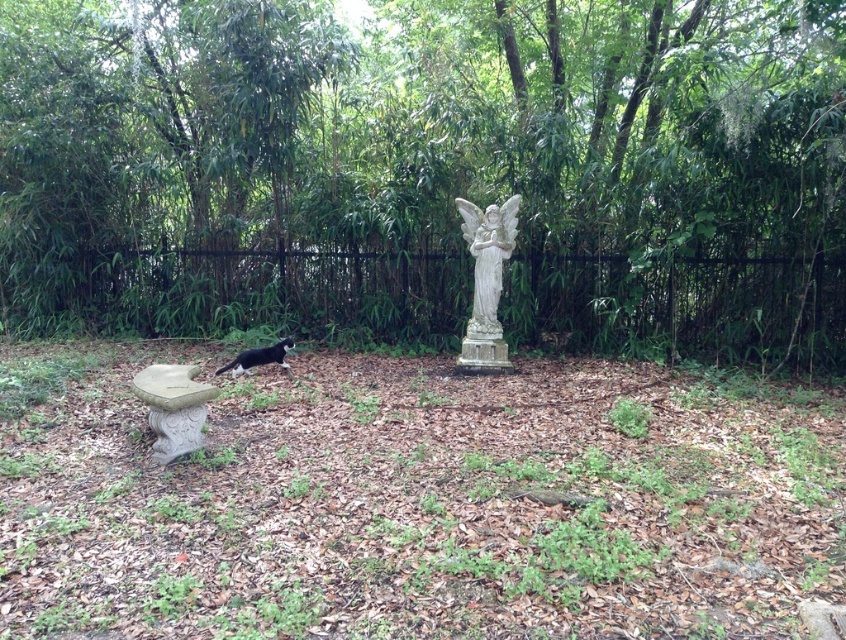
Question: Which object appears farthest from the camera in this image?

Choices:
 (A) black and white fur cat at lower left
 (B) white stone statue at center

Answer: (A)

Question: Is the position of white stone statue at center more distant than that of black metal fence at center?

Choices:
 (A) yes
 (B) no

Answer: (B)

Question: Estimate the real-world distances between objects in this image. Which object is closer to the green leafy tree at center?

Choices:
 (A) black and white fur cat at lower left
 (B) white stone angel at center
 (C) black metal fence at center
 (D) white stone statue at center

Answer: (B)

Question: Does white stone statue at center have a smaller size compared to white stone angel at center?

Choices:
 (A) yes
 (B) no

Answer: (B)

Question: Which of the following is the farthest from the observer?

Choices:
 (A) (487, 236)
 (B) (344, 396)

Answer: (A)

Question: Does green leafy tree at center have a greater width compared to black metal fence at center?

Choices:
 (A) no
 (B) yes

Answer: (A)